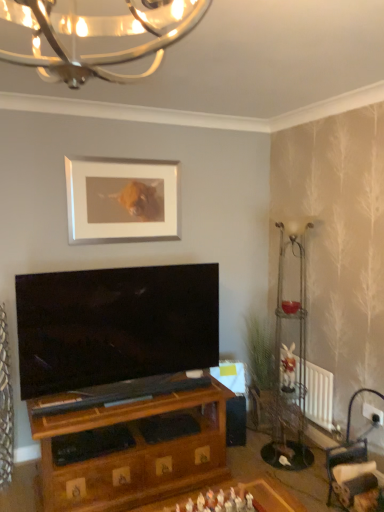
This screenshot has height=512, width=384. Identify the location of free space above white matte picture frame at upper center (from a real-world perspective). (124, 156).